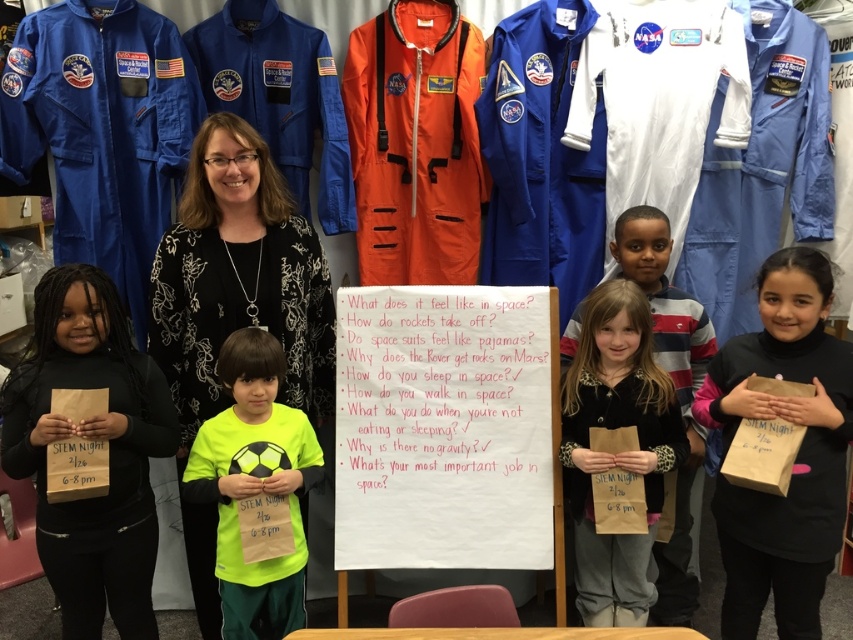
You are a parent at STEM Night holding a 1.2 meter wide box. You need to move it from the brown paper bag at lower left to the matte brown paper bag at center. Is there enough space to move the box without tilting it?

The distance between the brown paper bag at lower left and the matte brown paper bag at center is 1.45 meters. Since the box is 1.2 meters wide, there is enough space to move it without tilting.

You are organizing a STEM Night event and need to distribute materials. You have two paper bags available. The brown paper bag at lower left and the matte brown paper bag at center. Which bag should you choose if you need a larger capacity to hold more materials?

The matte brown paper bag at center has a larger capacity because it occupies more space than the brown paper bag at lower left.